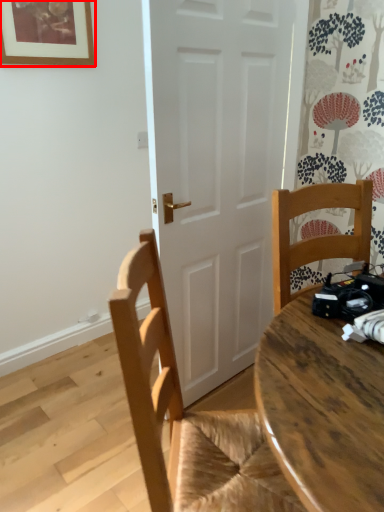
Question: From the image's perspective, what is the correct spatial positioning of picture frame (annotated by the red box) in reference to chair?

Choices:
 (A) below
 (B) above

Answer: (B)